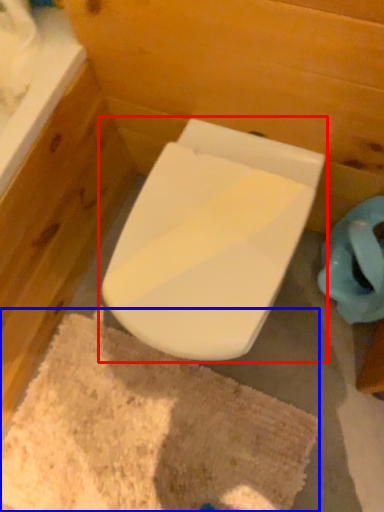
Question: Which of the following is the farthest to the observer, toilet (highlighted by a red box) or bath mat (highlighted by a blue box)?

Choices:
 (A) toilet
 (B) bath mat

Answer: (B)